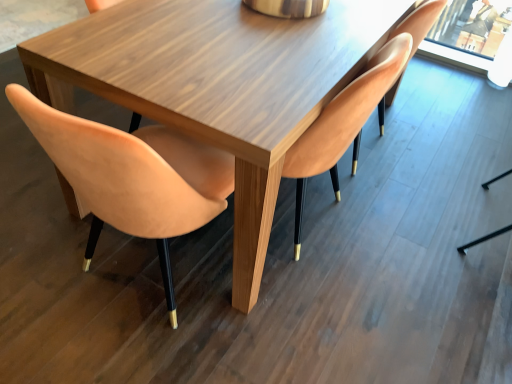
Image resolution: width=512 pixels, height=384 pixels. Find the location of `vacant area that is situated to the right of matte wood chair at center, the 2th chair positioned from the left`. vacant area that is situated to the right of matte wood chair at center, the 2th chair positioned from the left is located at coordinates (400, 236).